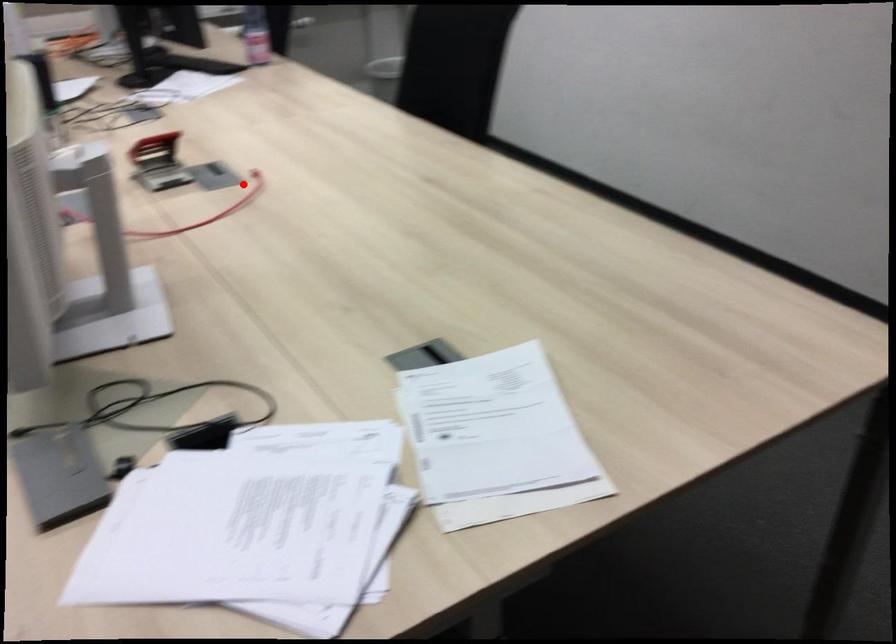
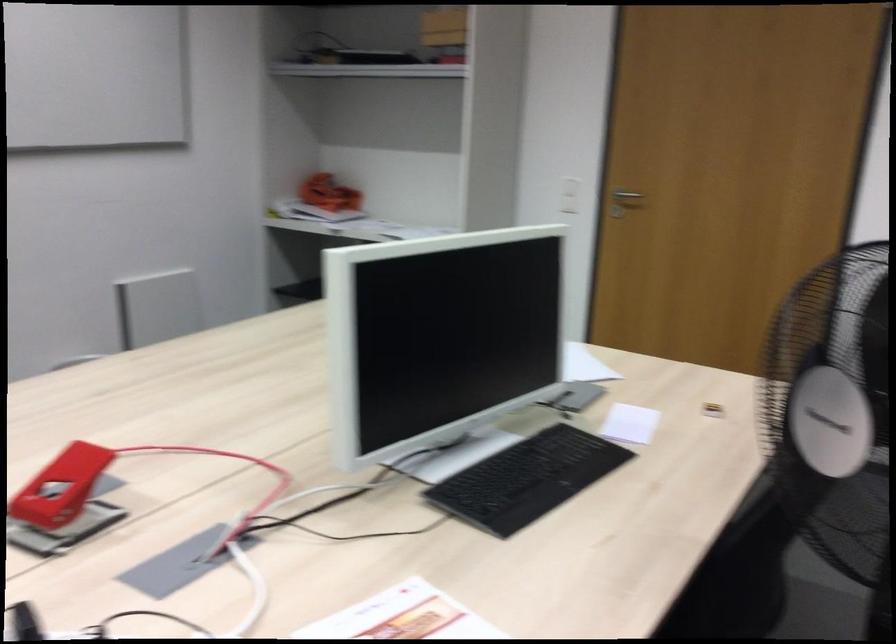
Question: I am providing you with two images of the same scene from different viewpoints. In image1, a red point is highlighted. Considering the same 3D point in image2, which of the following is correct?

Choices:
 (A) It is closer
 (B) It is farther

Answer: (A)